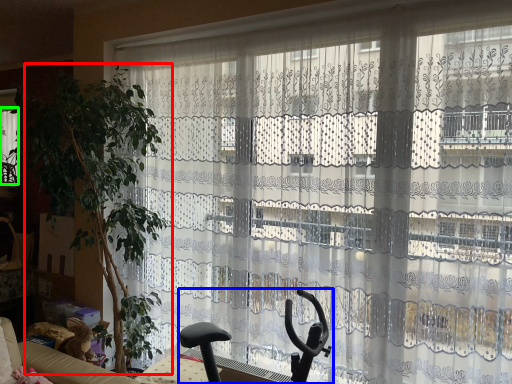
Question: Estimate the real-world distances between objects in this image. Which object is closer to plant (highlighted by a red box), swivel chair (highlighted by a blue box) or window (highlighted by a green box)?

Choices:
 (A) swivel chair
 (B) window

Answer: (A)